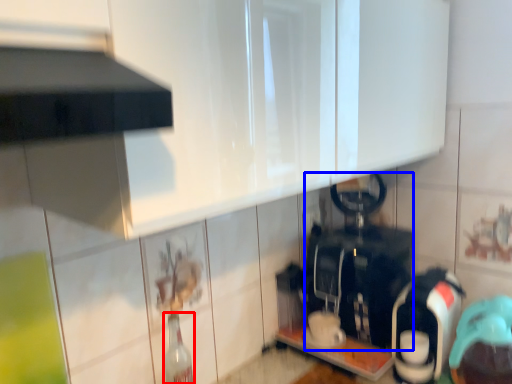
Question: Which point is closer to the camera, bottle (highlighted by a red box) or appliance (highlighted by a blue box)?

Choices:
 (A) bottle
 (B) appliance

Answer: (A)